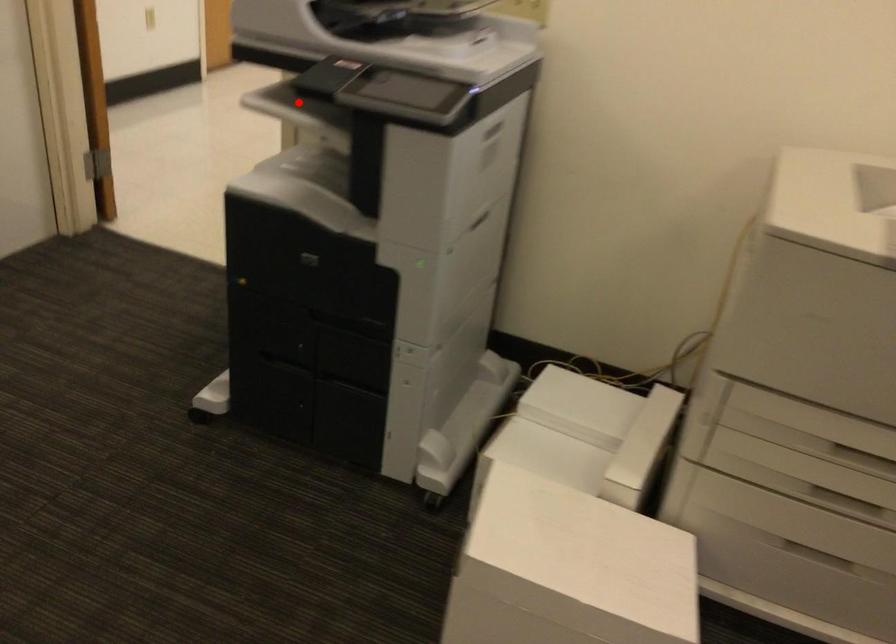
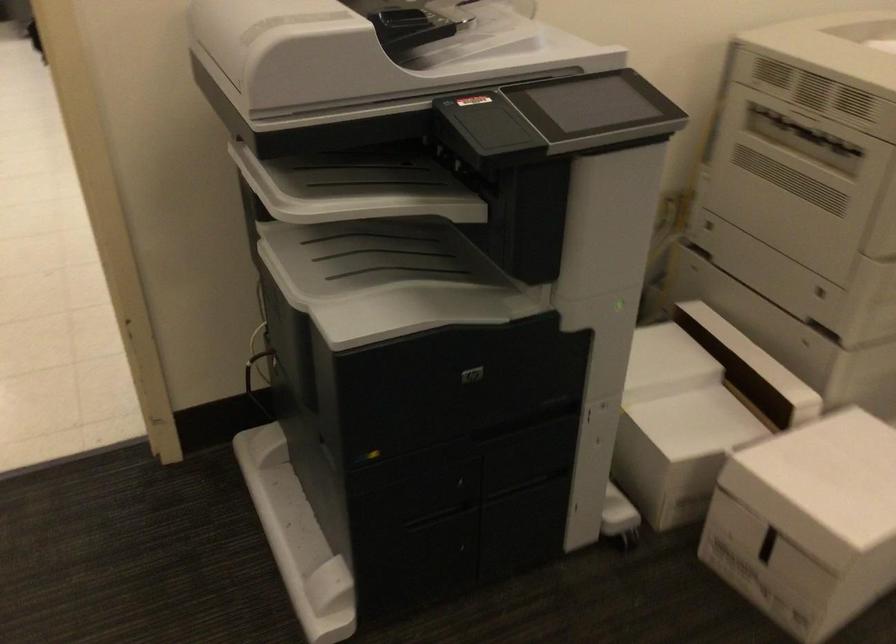
Where in the second image is the point corresponding to the highlighted location from the first image?

(354, 187)